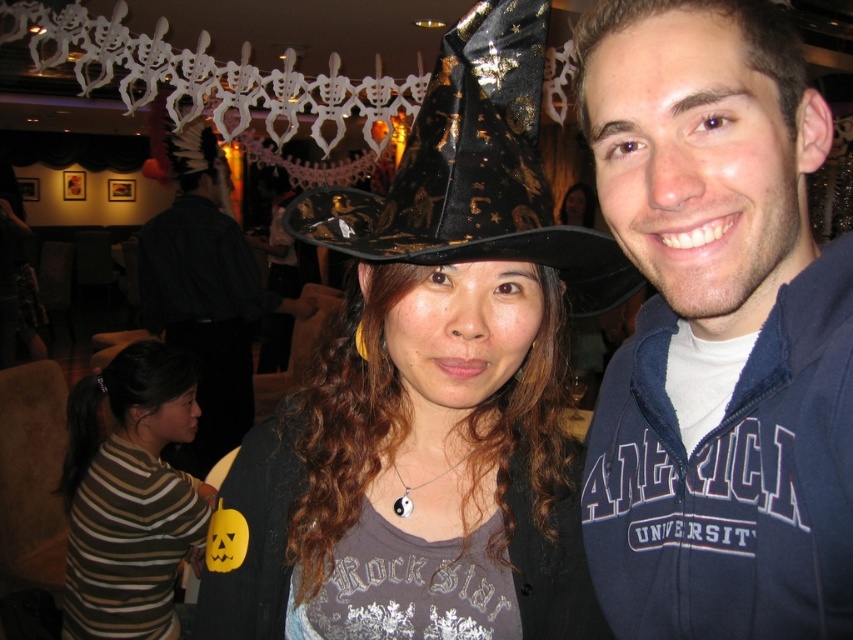
Can you confirm if brown striped shirt at lower left is positioned to the left of matte black witch hat at center?

Correct, you'll find brown striped shirt at lower left to the left of matte black witch hat at center.

Who is lower down, brown striped shirt at lower left or matte black witch hat at center?

brown striped shirt at lower left

Which is in front, point (82, 465) or point (595, 196)?

Positioned in front is point (82, 465).

Where is `brown striped shirt at lower left`? Image resolution: width=853 pixels, height=640 pixels. brown striped shirt at lower left is located at coordinates (129, 496).

Is black shiny fabric cowboy hat at center wider than matte black witch hat at center?

Correct, the width of black shiny fabric cowboy hat at center exceeds that of matte black witch hat at center.

Can you confirm if black shiny fabric cowboy hat at center is taller than matte black witch hat at center?

In fact, black shiny fabric cowboy hat at center may be shorter than matte black witch hat at center.

Does point (569, 236) come closer to viewer compared to point (579, 209)?

Yes, point (569, 236) is closer to viewer.

At what (x,y) coordinates should I click in order to perform the action: click on black shiny fabric cowboy hat at center. Please return your answer as a coordinate pair (x, y). This screenshot has width=853, height=640. Looking at the image, I should click on (473, 172).

Does point (183, 193) come behind point (566, 216)?

No, it is not.

Is point (236, 371) closer to viewer compared to point (567, 204)?

Yes, it is.

At what (x,y) coordinates should I click in order to perform the action: click on black matte jacket at left. Please return your answer as a coordinate pair (x, y). Looking at the image, I should click on (202, 288).